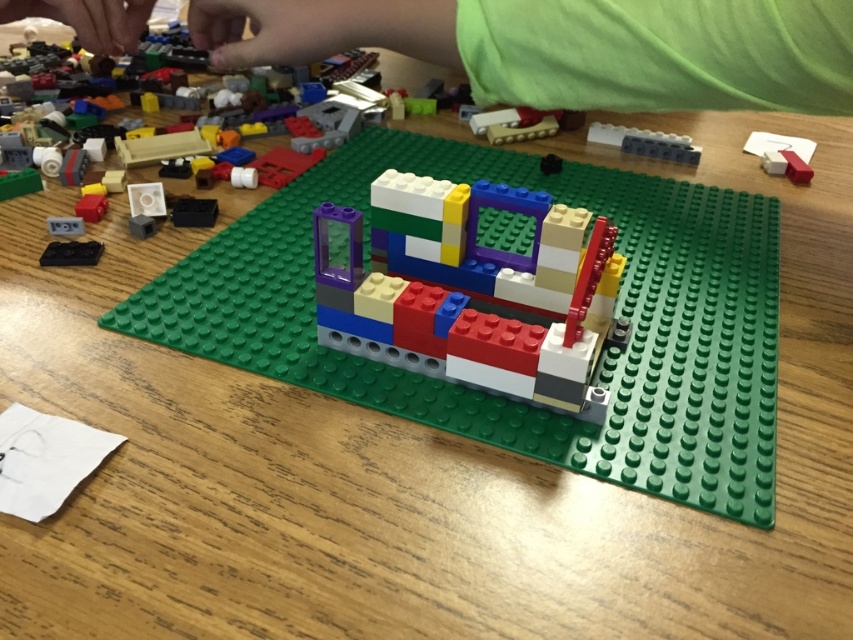
Question: Where is green fabric arm at upper center located in relation to translucent purple plastic at upper left in the image?

Choices:
 (A) right
 (B) left

Answer: (A)

Question: Among these objects, which one is farthest from the camera?

Choices:
 (A) multicolored plastic bricks at center
 (B) translucent purple plastic at upper left

Answer: (B)

Question: Which is farther from the gray matte brick at upper right?

Choices:
 (A) green fabric arm at upper center
 (B) multicolored plastic bricks at center

Answer: (B)

Question: Is matte black brick at lower left to the right of translucent purple plastic at upper left from the viewer's perspective?

Choices:
 (A) yes
 (B) no

Answer: (A)

Question: Does multicolored plastic bricks at center appear on the right side of gray matte brick at upper right?

Choices:
 (A) yes
 (B) no

Answer: (B)

Question: Which object is closer to the camera taking this photo?

Choices:
 (A) multicolored plastic bricks at center
 (B) matte black brick at lower left
 (C) translucent purple plastic at upper left
 (D) green fabric arm at upper center

Answer: (A)